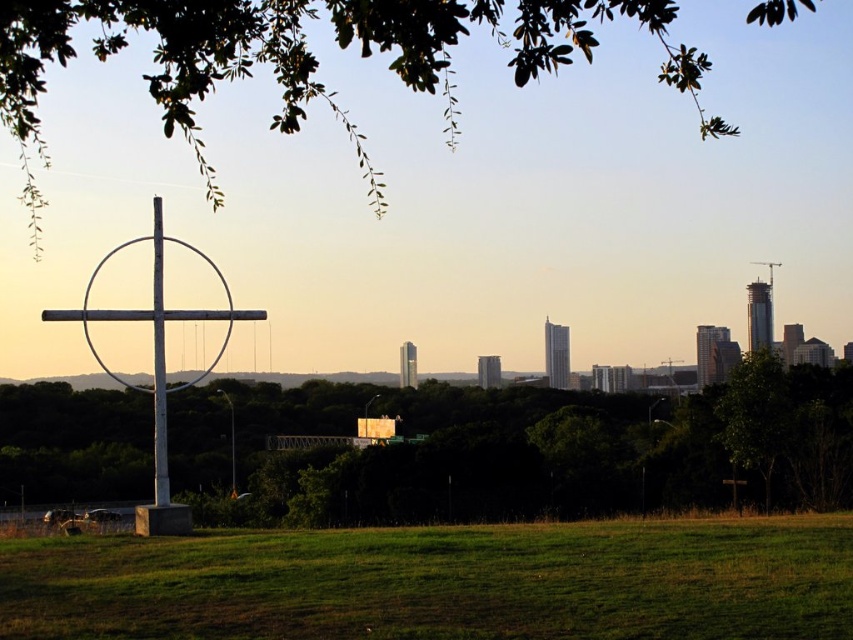
Question: Which object is the farthest from the green grass at lower center?

Choices:
 (A) white painted wood cross at left
 (B) metallic pole at left
 (C) green leafy tree at lower center

Answer: (C)

Question: Can you confirm if green leafy tree at lower center is bigger than green leafy tree at upper center?

Choices:
 (A) yes
 (B) no

Answer: (B)

Question: Which point is closer to the camera?

Choices:
 (A) (288, 595)
 (B) (180, 518)
 (C) (0, 44)
 (D) (549, 404)

Answer: (C)

Question: Among these points, which one is nearest to the camera?

Choices:
 (A) (309, 554)
 (B) (215, 196)

Answer: (A)

Question: Is green leafy tree at lower center to the left of white painted wood cross at left from the viewer's perspective?

Choices:
 (A) no
 (B) yes

Answer: (A)

Question: Is green leafy tree at lower center positioned at the back of green leafy tree at upper center?

Choices:
 (A) no
 (B) yes

Answer: (B)